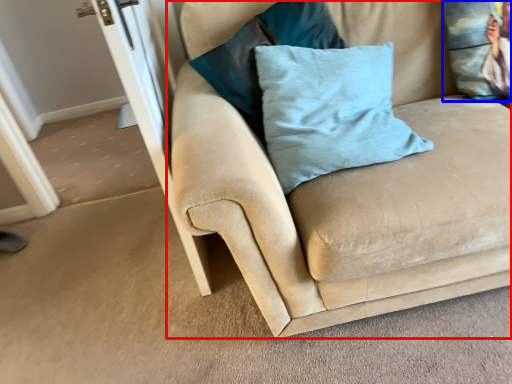
Question: Which of the following is the closest to the observer, studio couch (highlighted by a red box) or pillow (highlighted by a blue box)?

Choices:
 (A) studio couch
 (B) pillow

Answer: (A)